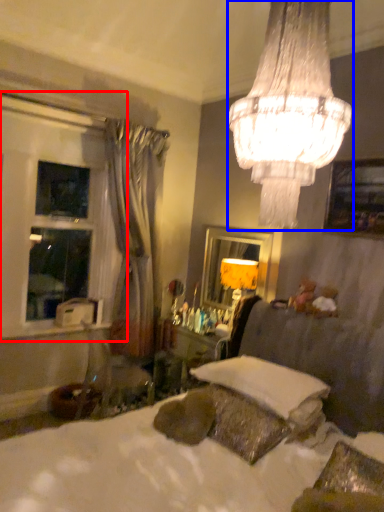
Question: Which point is closer to the camera, bay window (highlighted by a red box) or lamp (highlighted by a blue box)?

Choices:
 (A) bay window
 (B) lamp

Answer: (B)